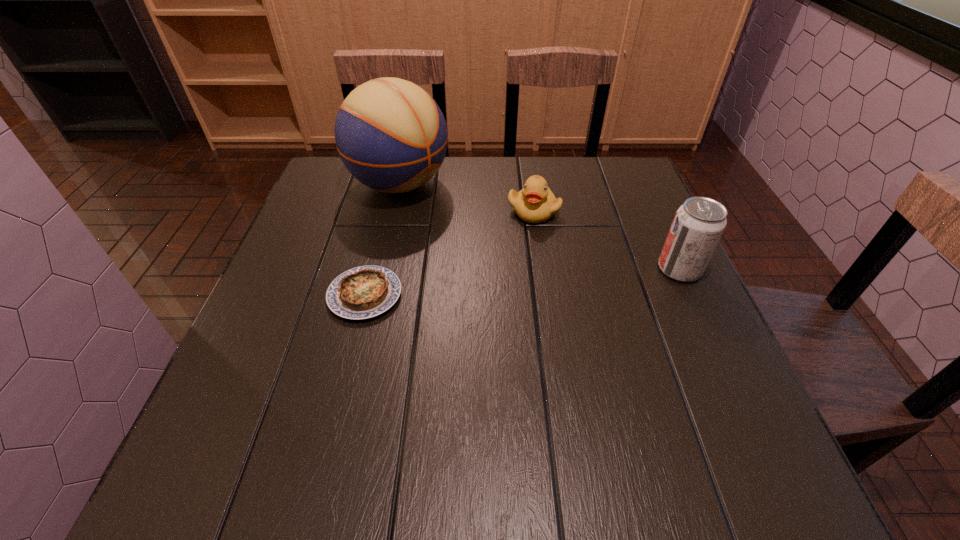
Find the location of a particular element. This screenshot has width=960, height=540. vacant area that lies between the rightmost object and the basketball is located at coordinates (540, 227).

You are a GUI agent. You are given a task and a screenshot of the screen. Output one action in this format:
    pyautogui.click(x=<x>, y=<y>)
    Task: Click on the vacant point located between the tallest object and the quiche
    The height and width of the screenshot is (540, 960).
    Given the screenshot: What is the action you would take?
    pyautogui.click(x=382, y=240)

What are the coordinates of `vacant space that's between the tallest object and the rightmost object` in the screenshot? It's located at (540, 227).

Where is `vacant space that is in between the third object from left to right and the second tallest object`? This screenshot has height=540, width=960. vacant space that is in between the third object from left to right and the second tallest object is located at coordinates (607, 240).

Find the location of `vacant area between the tallest object and the third shortest object`. vacant area between the tallest object and the third shortest object is located at coordinates (540, 227).

Locate which object is the closest to the tallest object. Please provide its 2D coordinates. Your answer should be formatted as a tuple, i.e. [(x, y)], where the tuple contains the x and y coordinates of a point satisfying the conditions above.

[(535, 203)]

The height and width of the screenshot is (540, 960). In order to click on object that stands as the closest to the rightmost object in this screenshot , I will do `click(535, 203)`.

The image size is (960, 540). Find the location of `vacant area in the image that satisfies the following two spatial constraints: 1. on the front side of the duckling; 2. on the left side of the second tallest object`. vacant area in the image that satisfies the following two spatial constraints: 1. on the front side of the duckling; 2. on the left side of the second tallest object is located at coordinates (x=542, y=269).

In order to click on blank space that satisfies the following two spatial constraints: 1. on the back side of the soda can; 2. on the right side of the shortest object in this screenshot , I will do `click(372, 269)`.